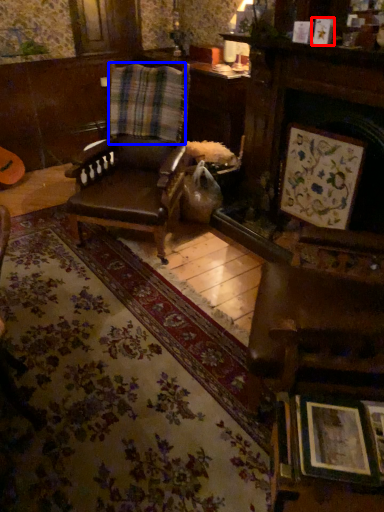
Question: Which object is further to the camera taking this photo, picture frame (highlighted by a red box) or curtain (highlighted by a blue box)?

Choices:
 (A) picture frame
 (B) curtain

Answer: (B)